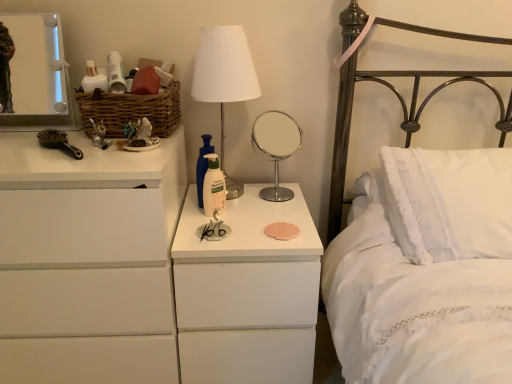
The height and width of the screenshot is (384, 512). Identify the location of vacant region to the left of matte white figurine at center, which is the 2th toy in left-to-right order. (79, 156).